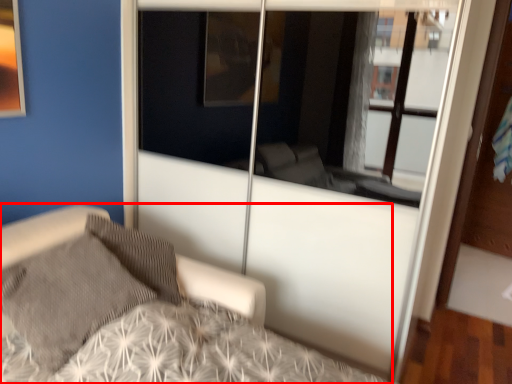
Question: From the image's perspective, where is bed (annotated by the red box) located in relation to pillow in the image?

Choices:
 (A) above
 (B) below

Answer: (B)